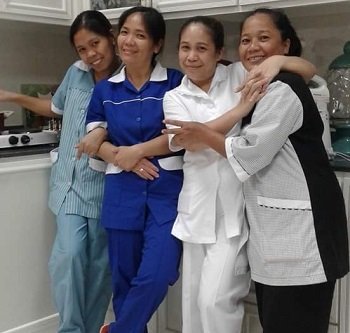
You are a GUI agent. You are given a task and a screenshot of the screen. Output one action in this format:
    pyautogui.click(x=<x>, y=<y>)
    Task: Click on the mixer
    The image size is (350, 333).
    Given the screenshot: What is the action you would take?
    pyautogui.click(x=324, y=95)